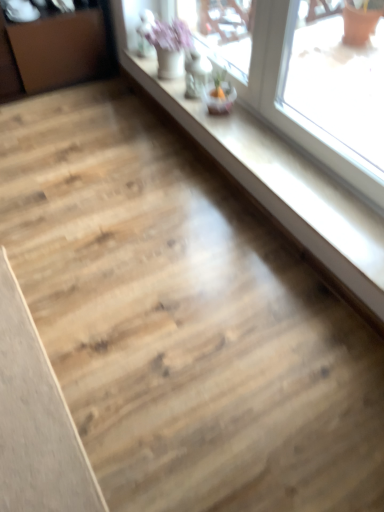
Question: In terms of height, does transparent glass window at upper right look taller or shorter compared to brown wood dresser at left?

Choices:
 (A) short
 (B) tall

Answer: (A)

Question: From a real-world perspective, is transparent glass window at upper right physically located above or below brown wood dresser at left?

Choices:
 (A) above
 (B) below

Answer: (B)

Question: Which object is the closest to the light brown wood plank at lower left?

Choices:
 (A) transparent glass window at upper right
 (B) brown wood dresser at left

Answer: (A)

Question: Estimate the real-world distances between objects in this image. Which object is farther from the light brown wood plank at lower left?

Choices:
 (A) brown wood dresser at left
 (B) transparent glass window at upper right

Answer: (A)